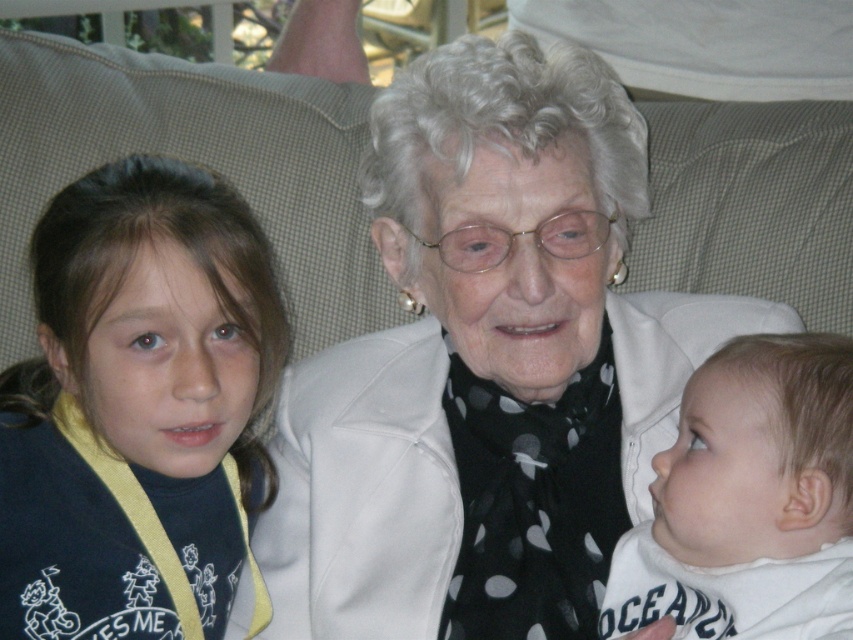
Question: Can you confirm if dark blue fabric shirt at left is bigger than white soft fabric at right?

Choices:
 (A) yes
 (B) no

Answer: (A)

Question: Can you confirm if white matte jacket at center is bigger than dark blue fabric shirt at left?

Choices:
 (A) no
 (B) yes

Answer: (B)

Question: Which of the following is the closest to the observer?

Choices:
 (A) white matte jacket at center
 (B) dark blue fabric shirt at left
 (C) white soft fabric at right

Answer: (C)

Question: Is white matte jacket at center further to camera compared to white soft fabric at right?

Choices:
 (A) no
 (B) yes

Answer: (B)

Question: Which object is farther from the camera taking this photo?

Choices:
 (A) dark blue fabric shirt at left
 (B) white soft fabric at right

Answer: (A)

Question: Estimate the real-world distances between objects in this image. Which object is closer to the white matte jacket at center?

Choices:
 (A) white soft fabric at right
 (B) dark blue fabric shirt at left

Answer: (B)